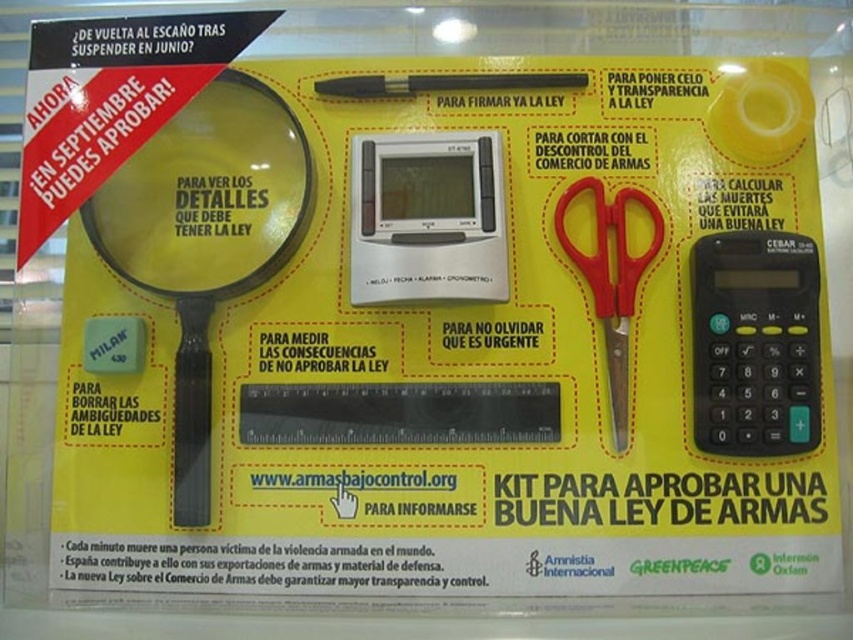
Question: Which point appears closest to the camera in this image?

Choices:
 (A) (544, 77)
 (B) (236, 125)
 (C) (764, 429)
 (D) (618, 195)

Answer: (C)

Question: Is red plastic scissors at center right to the right of black plastic pen at center from the viewer's perspective?

Choices:
 (A) no
 (B) yes

Answer: (B)

Question: Does black plastic calculator at right appear on the right side of black plastic pen at center?

Choices:
 (A) yes
 (B) no

Answer: (A)

Question: Which object is farther from the camera taking this photo?

Choices:
 (A) transparent plastic magnifying glass at upper left
 (B) black plastic pen at center
 (C) red plastic scissors at center right
 (D) black plastic calculator at right

Answer: (B)

Question: Among these objects, which one is nearest to the camera?

Choices:
 (A) red plastic scissors at center right
 (B) black plastic calculator at right
 (C) transparent plastic magnifying glass at upper left

Answer: (B)

Question: Can you confirm if transparent plastic magnifying glass at upper left is wider than black plastic calculator at right?

Choices:
 (A) yes
 (B) no

Answer: (A)